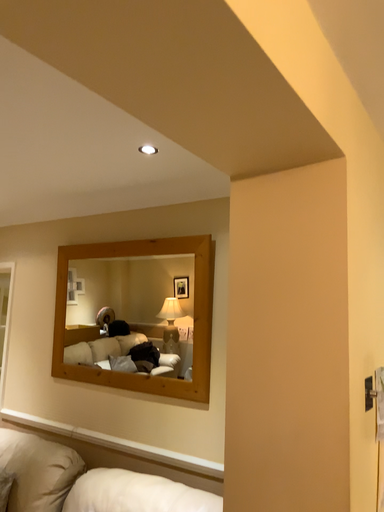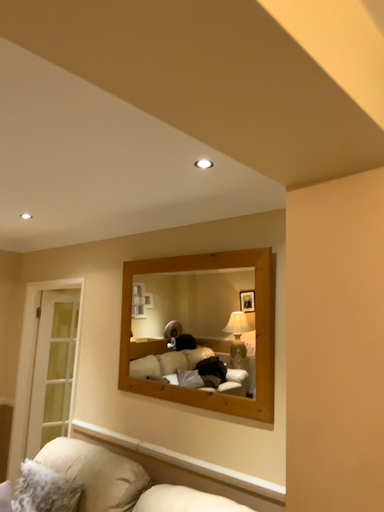
Question: Which way did the camera rotate in the video?

Choices:
 (A) rotated right
 (B) rotated left

Answer: (B)